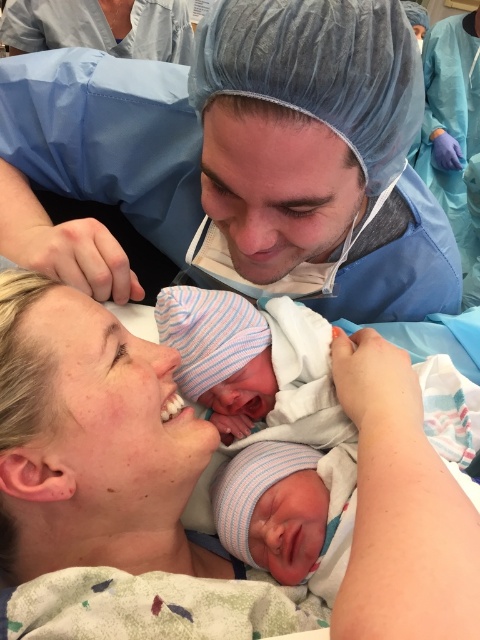
Does blue mesh cap at upper center lie in front of blue smooth scrubs at upper right?

That is True.

In the scene shown: Is blue mesh cap at upper center bigger than blue smooth scrubs at upper right?

Yes, blue mesh cap at upper center is bigger than blue smooth scrubs at upper right.

Is point (225, 243) farther from viewer compared to point (468, 65)?

No, it is in front of (468, 65).

The height and width of the screenshot is (640, 480). I want to click on blue mesh cap at upper center, so click(238, 161).

Who is positioned more to the right, striped knit cap at center or blue smooth scrubs at upper right?

From the viewer's perspective, blue smooth scrubs at upper right appears more on the right side.

Which is behind, point (203, 300) or point (427, 182)?

Point (427, 182)

Who is more distant from viewer, (334,422) or (476,240)?

Positioned behind is point (476,240).

This screenshot has height=640, width=480. Find the location of `striped knit cap at center`. striped knit cap at center is located at coordinates (238, 352).

Between blue mesh cap at upper center and smooth skin face at lower left, which one is positioned higher?

blue mesh cap at upper center

Between blue mesh cap at upper center and smooth skin face at lower left, which one appears on the left side from the viewer's perspective?

smooth skin face at lower left is more to the left.

Which is in front, point (247, 140) or point (144, 372)?

Point (247, 140)

Identify the location of blue mesh cap at upper center. This screenshot has height=640, width=480. (238, 161).